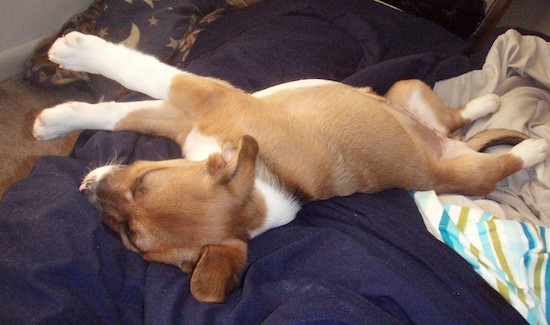
You are a GUI agent. You are given a task and a screenshot of the screen. Output one action in this format:
    pyautogui.click(x=<x>, y=<y>)
    Task: Click on the blanket
    
    Given the screenshot: What is the action you would take?
    pyautogui.click(x=491, y=252), pyautogui.click(x=406, y=266), pyautogui.click(x=512, y=114), pyautogui.click(x=159, y=31)